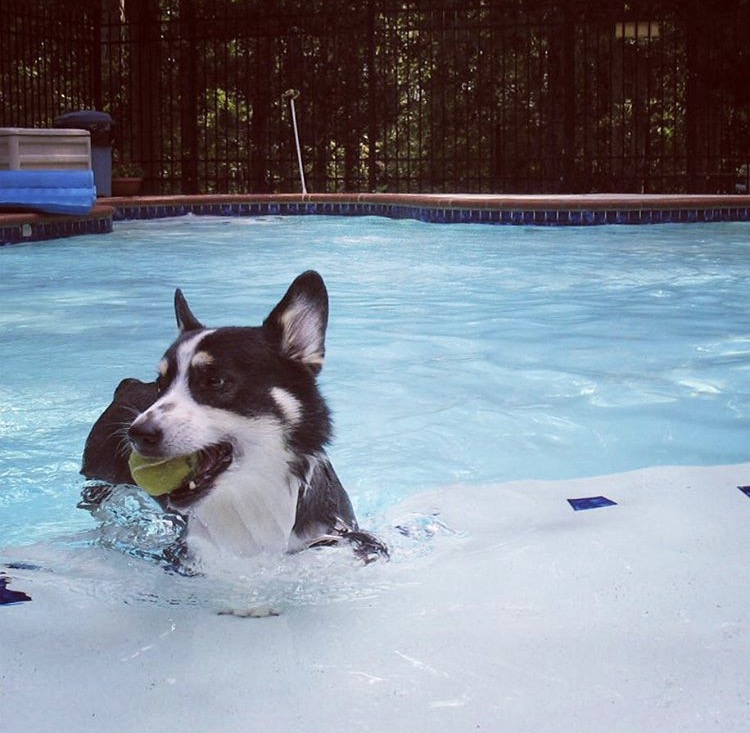
The height and width of the screenshot is (733, 750). I want to click on tiles, so click(x=496, y=213).